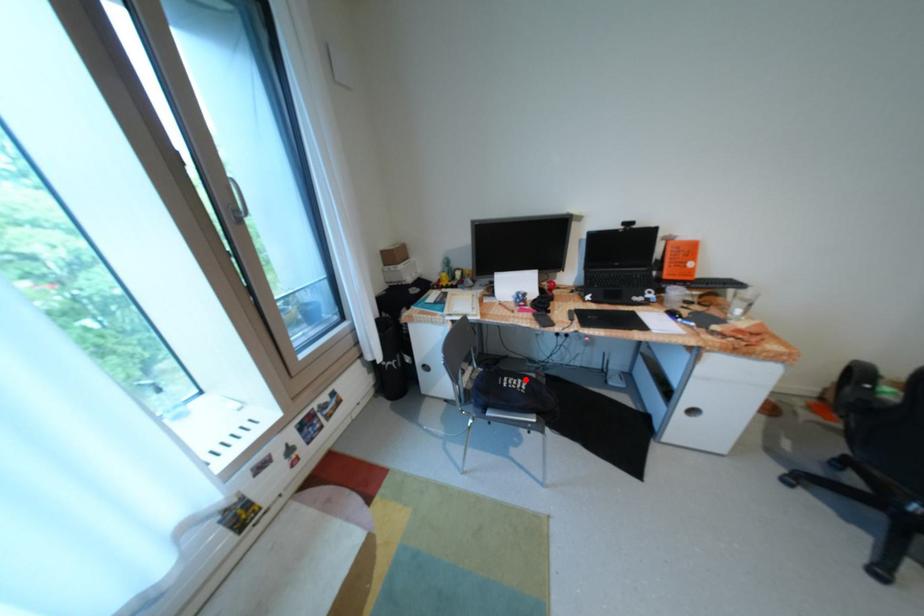
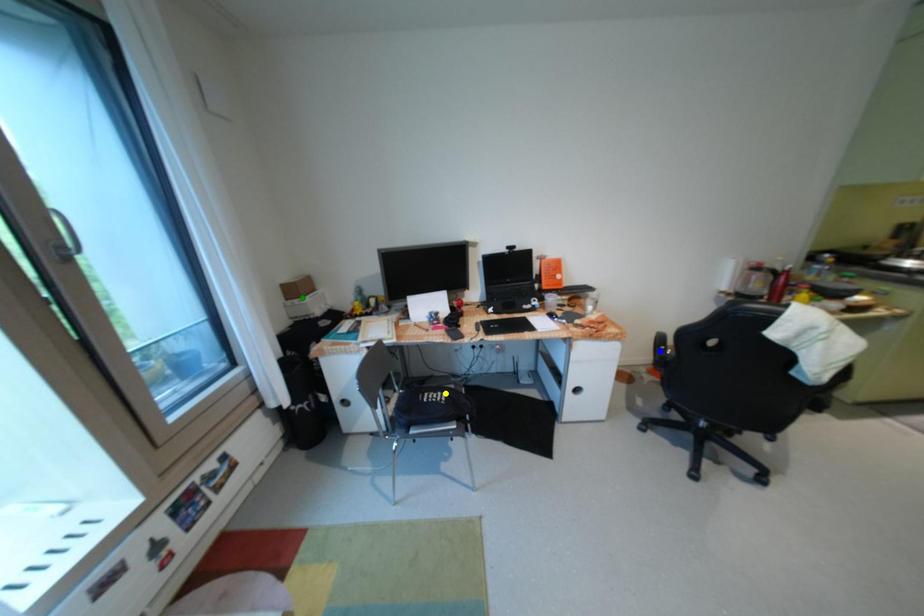
Question: I am providing you with two images of the same scene from different viewpoints. A red point is marked on the first image. You are given multiple points on the second image. Can you choose the point in image 2 that corresponds to the point in image 1?

Choices:
 (A) blue point
 (B) yellow point
 (C) green point

Answer: (B)